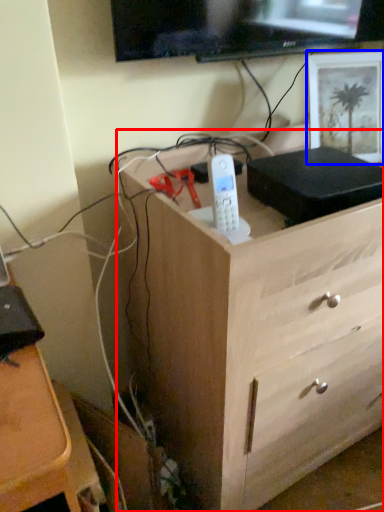
Question: Which point is closer to the camera, chest of drawers (highlighted by a red box) or picture frame (highlighted by a blue box)?

Choices:
 (A) chest of drawers
 (B) picture frame

Answer: (A)